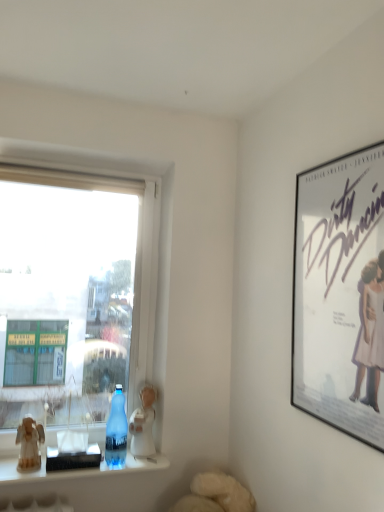
Question: Considering the positions of transparent glass bottle at window and white porcelain figurine at lower center, placed as the 1th figurine when sorted from back to front, in the image, is transparent glass bottle at window bigger or smaller than white porcelain figurine at lower center, placed as the 1th figurine when sorted from back to front,?

Choices:
 (A) big
 (B) small

Answer: (B)

Question: In terms of width, does transparent glass bottle at window look wider or thinner when compared to white porcelain figurine at lower center, placed as the 1th figurine when sorted from back to front?

Choices:
 (A) thin
 (B) wide

Answer: (A)

Question: Which object is positioned closest to the white porcelain figurine at lower center, acting as the second figurine starting from the front?

Choices:
 (A) white matte poster at upper right
 (B) transparent glass window at left
 (C) wooden figurine at left, which ranks as the first figurine in left-to-right order
 (D) translucent glass water at lower left
 (E) transparent glass bottle at window

Answer: (E)

Question: Which object is the farthest from the white matte poster at upper right?

Choices:
 (A) transparent glass window at left
 (B) transparent glass bottle at window
 (C) translucent glass water at lower left
 (D) wooden figurine at left, which ranks as the first figurine in left-to-right order
 (E) white porcelain figurine at lower center, acting as the second figurine starting from the front

Answer: (D)